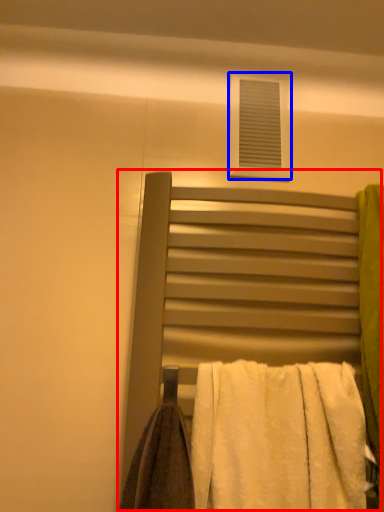
Question: Which point is closer to the camera, bed (highlighted by a red box) or window (highlighted by a blue box)?

Choices:
 (A) bed
 (B) window

Answer: (A)